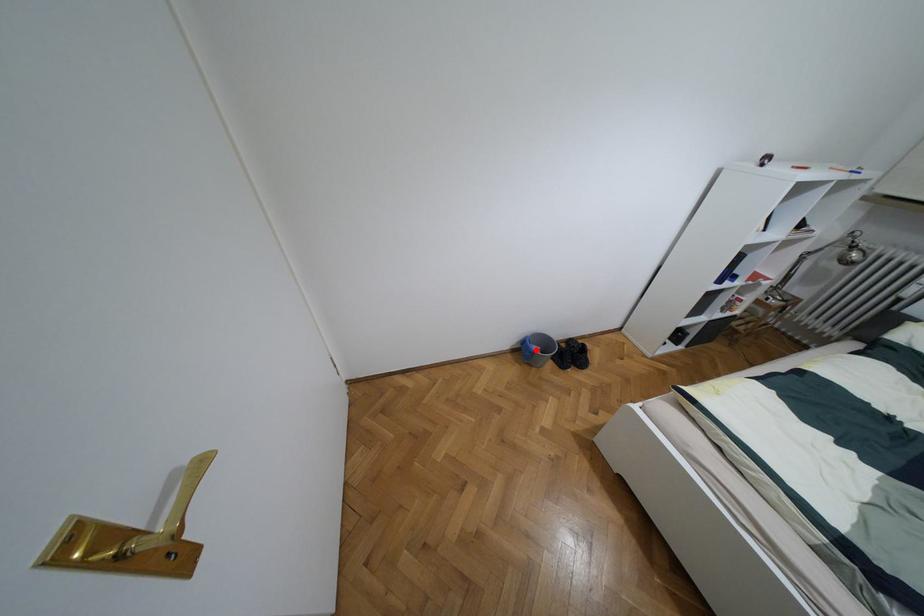
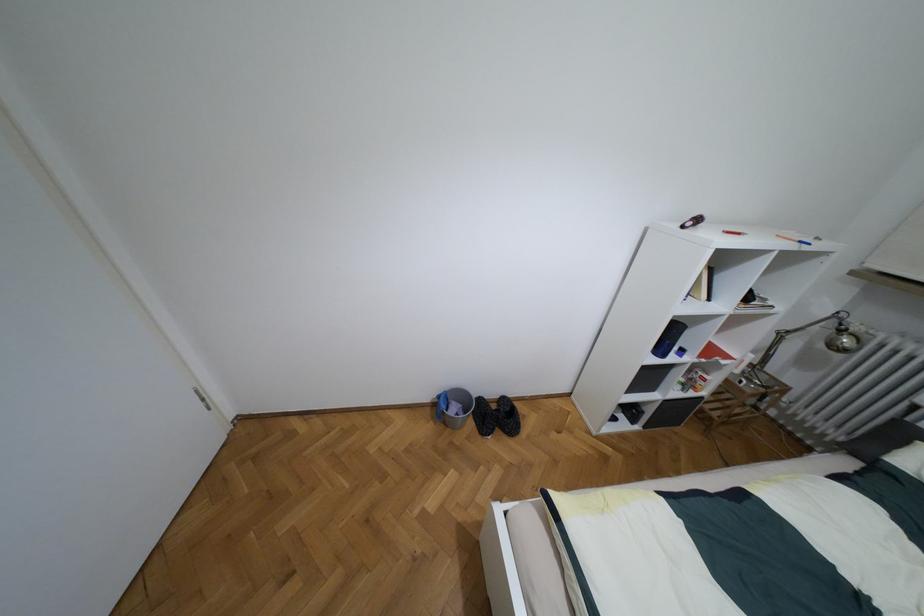
Locate, in the second image, the point that corresponds to the highlighted location in the first image.

(453, 408)